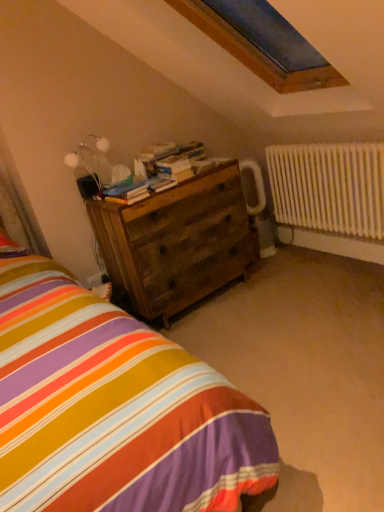
Question: From the image's perspective, does wooden books at center, the first book viewed from the top, appear higher than wooden chest of drawers at center?

Choices:
 (A) yes
 (B) no

Answer: (A)

Question: Can you confirm if wooden books at center, the 1th book viewed from the back, is thinner than wooden chest of drawers at center?

Choices:
 (A) yes
 (B) no

Answer: (A)

Question: Is wooden books at center, the 2th book positioned from the bottom, smaller than wooden chest of drawers at center?

Choices:
 (A) yes
 (B) no

Answer: (A)

Question: From a real-world perspective, is wooden books at center, the 1th book viewed from the back, physically below wooden chest of drawers at center?

Choices:
 (A) no
 (B) yes

Answer: (A)

Question: Are wooden books at center, the 2th book positioned from the bottom, and wooden chest of drawers at center located far from each other?

Choices:
 (A) yes
 (B) no

Answer: (B)

Question: Considering the positions of point (99, 142) and point (273, 206), is point (99, 142) closer or farther from the camera than point (273, 206)?

Choices:
 (A) farther
 (B) closer

Answer: (B)

Question: Is metallic silver table lamp at upper left situated inside white painted metal radiator at right or outside?

Choices:
 (A) outside
 (B) inside

Answer: (A)

Question: Is metallic silver table lamp at upper left wider or thinner than white painted metal radiator at right?

Choices:
 (A) thin
 (B) wide

Answer: (B)

Question: Considering their positions, is metallic silver table lamp at upper left located in front of or behind white painted metal radiator at right?

Choices:
 (A) front
 (B) behind

Answer: (A)

Question: Visually, is wooden chest of drawers at center positioned to the left or to the right of metallic silver table lamp at upper left?

Choices:
 (A) left
 (B) right

Answer: (B)

Question: Is point (205, 212) closer or farther from the camera than point (97, 139)?

Choices:
 (A) closer
 (B) farther

Answer: (B)

Question: Is wooden chest of drawers at center bigger or smaller than metallic silver table lamp at upper left?

Choices:
 (A) small
 (B) big

Answer: (B)

Question: In the image, is wooden chest of drawers at center positioned in front of or behind metallic silver table lamp at upper left?

Choices:
 (A) front
 (B) behind

Answer: (A)

Question: Considering the positions of white painted metal radiator at right and wooden books at center, the 1th book viewed from the back, in the image, is white painted metal radiator at right wider or thinner than wooden books at center, the 1th book viewed from the back,?

Choices:
 (A) wide
 (B) thin

Answer: (B)

Question: In the image, is white painted metal radiator at right on the left side or the right side of wooden books at center, the first book viewed from the top?

Choices:
 (A) right
 (B) left

Answer: (A)